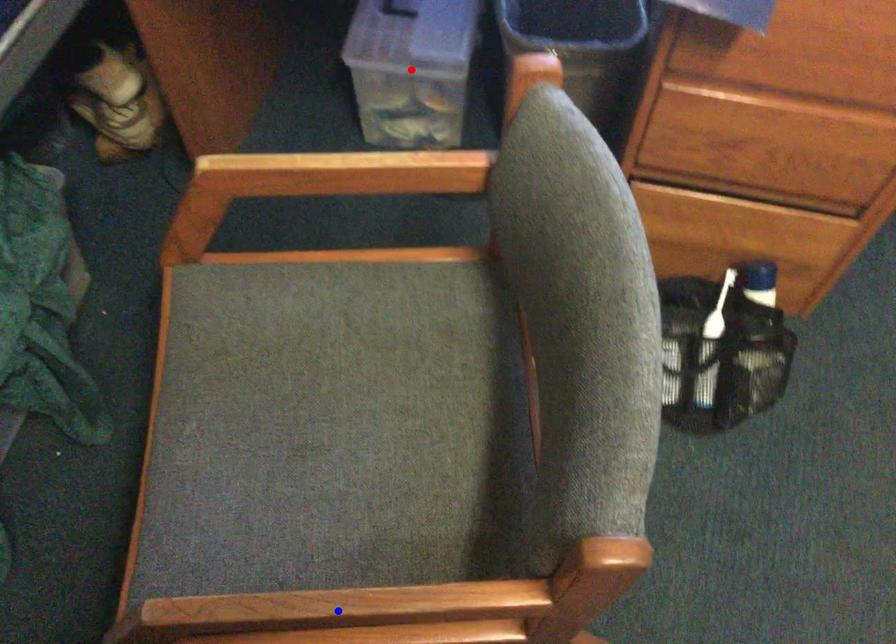
Question: Which of the two points in the image is closer to the camera?

Choices:
 (A) Blue point is closer.
 (B) Red point is closer.

Answer: (A)